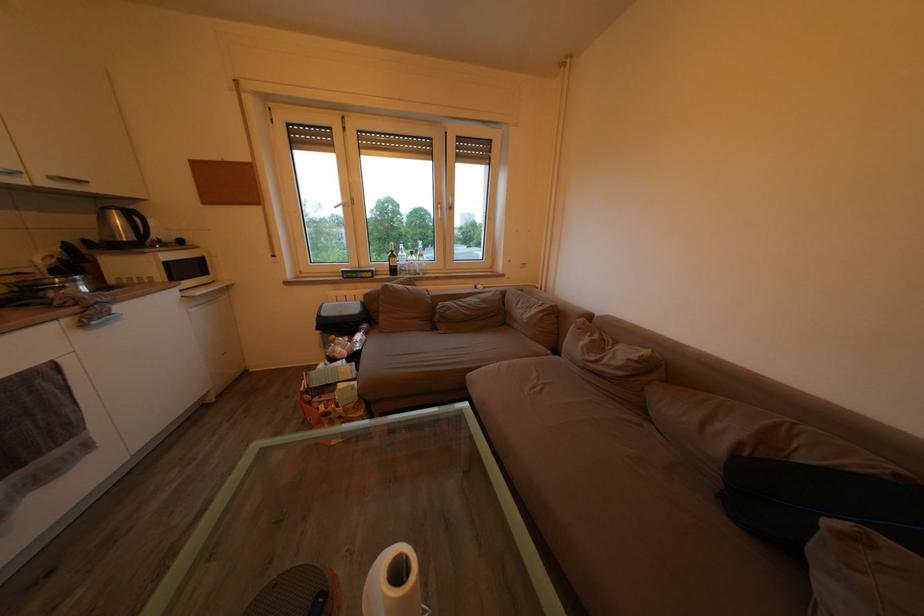
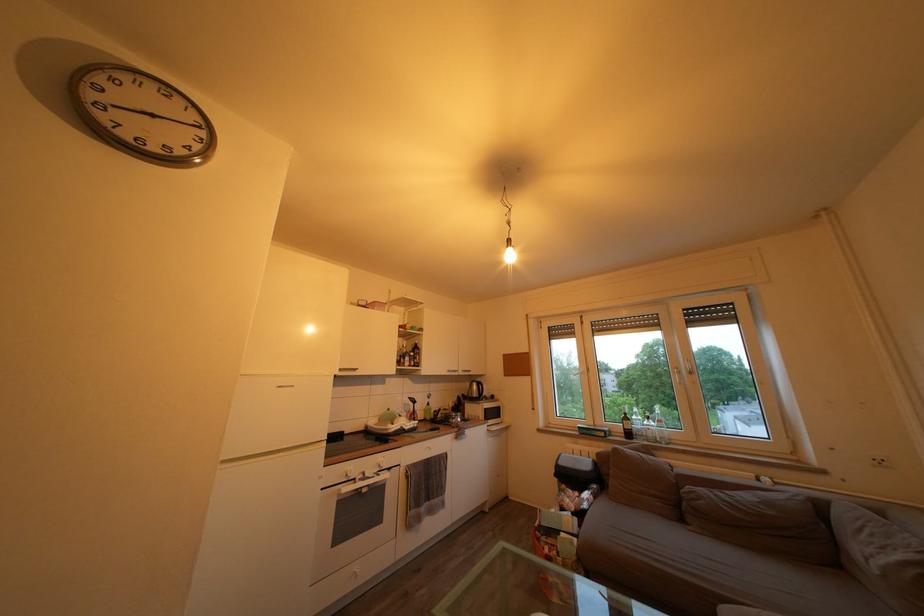
In the second image, find the point that corresponds to the point at 531,270 in the first image.

(889, 468)